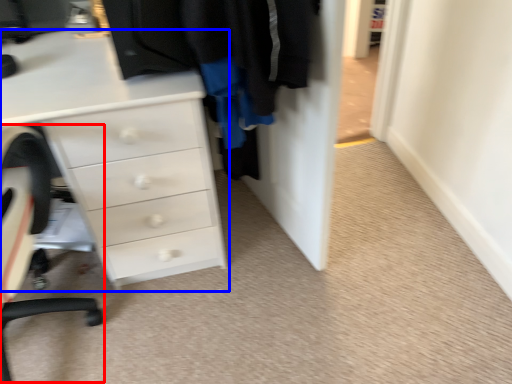
Question: Which of the following is the closest to the observer, computer chair (highlighted by a red box) or chest of drawers (highlighted by a blue box)?

Choices:
 (A) computer chair
 (B) chest of drawers

Answer: (A)